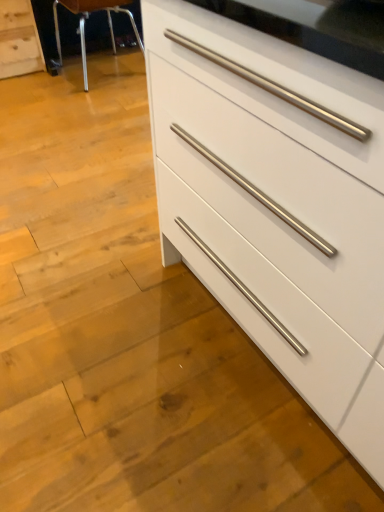
Where is `free space in front of metallic silver bar stool at upper left`? The height and width of the screenshot is (512, 384). free space in front of metallic silver bar stool at upper left is located at coordinates (82, 100).